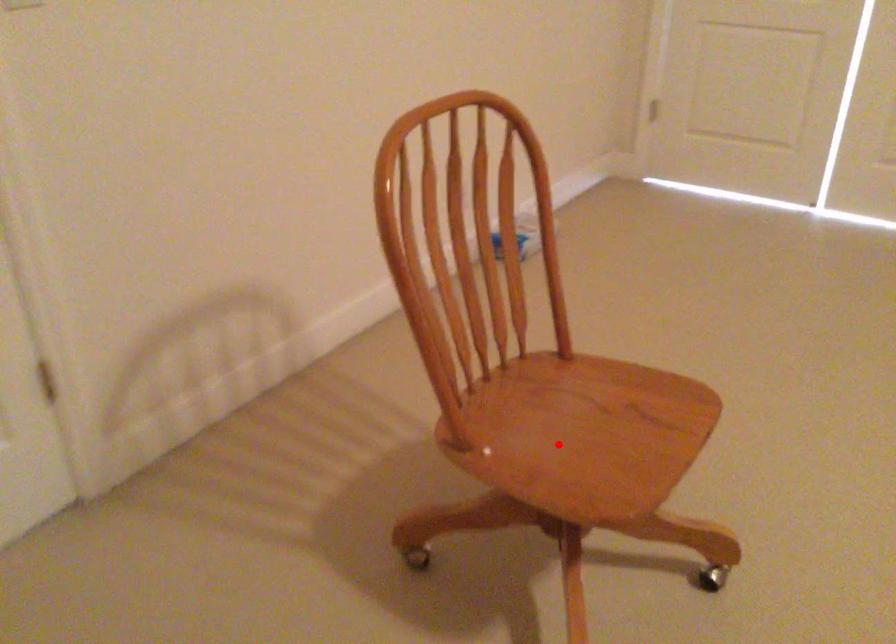
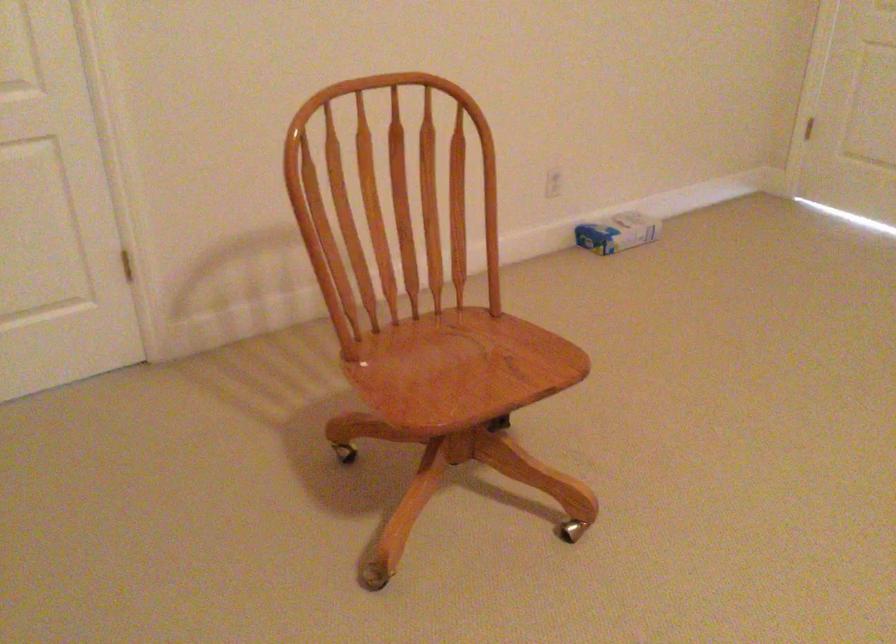
In the second image, find the point that corresponds to the highlighted location in the first image.

(428, 374)